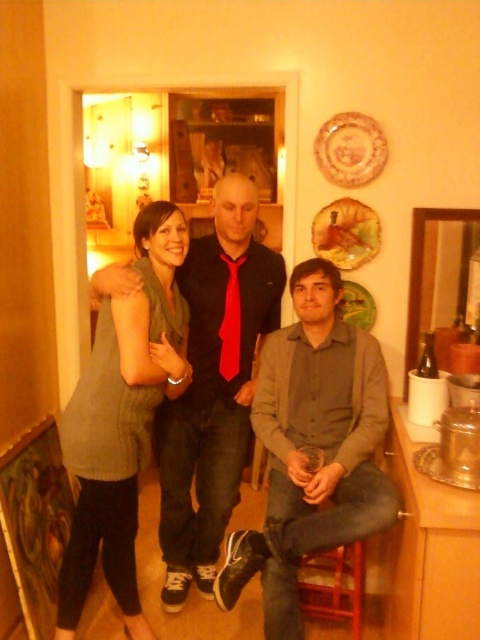
Question: Is matte gray shirt at center thinner than matte black shirt at center?

Choices:
 (A) yes
 (B) no

Answer: (B)

Question: Does matte black shirt at center have a greater width compared to green knit sweater at left?

Choices:
 (A) no
 (B) yes

Answer: (B)

Question: Among these points, which one is farthest from the camera?

Choices:
 (A) (312, 524)
 (B) (211, 550)
 (C) (143, 314)
 (D) (227, 257)

Answer: (B)

Question: Based on their relative distances, which object is farther from the matte gray shirt at center?

Choices:
 (A) matte black shirt at center
 (B) green knit sweater at left
 (C) red satin tie at center

Answer: (B)

Question: Does matte gray shirt at center have a lesser width compared to matte black shirt at center?

Choices:
 (A) no
 (B) yes

Answer: (A)

Question: Which is nearer to the matte gray shirt at center?

Choices:
 (A) green knit sweater at left
 (B) matte black shirt at center

Answer: (B)